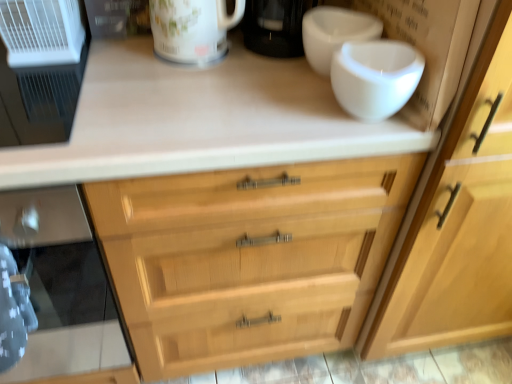
I want to click on vacant space to the right of white plastic cage at upper left, the first appliance in the top-to-bottom sequence, so click(x=123, y=52).